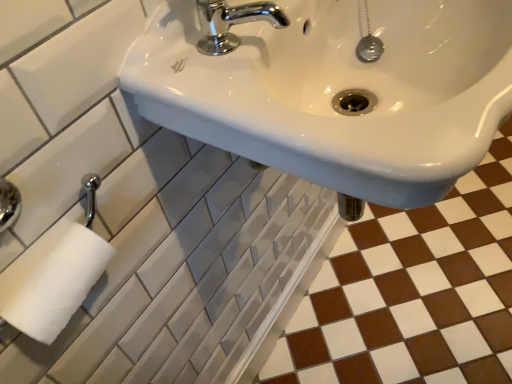
This screenshot has height=384, width=512. What do you see at coordinates (232, 23) in the screenshot?
I see `chrome/metallic faucet at upper center` at bounding box center [232, 23].

Find the location of `brown glossy tile at lower right`. brown glossy tile at lower right is located at coordinates (413, 293).

Is chrome/metallic faucet at upper center oriented towards white glossy sink at upper center?

No, chrome/metallic faucet at upper center does not turn towards white glossy sink at upper center.

Is chrome/metallic faucet at upper center spatially inside white glossy sink at upper center, or outside of it?

chrome/metallic faucet at upper center fits inside white glossy sink at upper center.

Is point (227, 8) positioned in front of point (275, 140)?

No, (227, 8) is behind (275, 140).

Looking at this image, is brown glossy tile at lower right positioned beyond the bounds of chrome/metallic faucet at upper center?

Absolutely, brown glossy tile at lower right is external to chrome/metallic faucet at upper center.

Considering the sizes of brown glossy tile at lower right and chrome/metallic faucet at upper center in the image, is brown glossy tile at lower right bigger or smaller than chrome/metallic faucet at upper center?

Considering their sizes, brown glossy tile at lower right takes up more space than chrome/metallic faucet at upper center.

Identify the location of ceramic tile on the right side of chrome/metallic faucet at upper center. This screenshot has width=512, height=384. (413, 293).

Which point is more forward, (284, 18) or (336, 244)?

Positioned in front is point (284, 18).

Is chrome/metallic faucet at upper center thinner than brown glossy tile at lower right?

Yes.

Is chrome/metallic faucet at upper center turned away from brown glossy tile at lower right?

No, chrome/metallic faucet at upper center is not facing away from brown glossy tile at lower right.

From a real-world perspective, is chrome/metallic faucet at upper center physically above brown glossy tile at lower right?

Yes.

Which is less distant, (308, 368) or (172, 42)?

Point (308, 368) is positioned farther from the camera compared to point (172, 42).

Considering the relative sizes of brown glossy tile at lower right and white glossy sink at upper center in the image provided, is brown glossy tile at lower right shorter than white glossy sink at upper center?

Indeed, brown glossy tile at lower right has a lesser height compared to white glossy sink at upper center.

Choose the correct answer: Is brown glossy tile at lower right inside white glossy sink at upper center or outside it?

brown glossy tile at lower right is outside white glossy sink at upper center.

How different are the orientations of brown glossy tile at lower right and white glossy sink at upper center in degrees?

The angular difference between brown glossy tile at lower right and white glossy sink at upper center is 90.9 degrees.

From the image's perspective, between white glossy sink at upper center and brown glossy tile at lower right, which one is located above?

white glossy sink at upper center, from the image's perspective.

Which is more to the right, white glossy sink at upper center or brown glossy tile at lower right?

brown glossy tile at lower right.

Does point (487, 50) appear closer or farther from the camera than point (295, 365)?

Point (487, 50).

Is white glossy sink at upper center not close to chrome/metallic faucet at upper center?

No, white glossy sink at upper center is not far away from chrome/metallic faucet at upper center.

Is white glossy sink at upper center turned away from chrome/metallic faucet at upper center?

No, white glossy sink at upper center is not facing away from chrome/metallic faucet at upper center.

From the image's perspective, which is above, white glossy sink at upper center or chrome/metallic faucet at upper center?

chrome/metallic faucet at upper center is shown above in the image.

Consider the image. How far apart are white glossy sink at upper center and chrome/metallic faucet at upper center?

The distance of white glossy sink at upper center from chrome/metallic faucet at upper center is 13.66 centimeters.

Where is `tap above the white glossy sink at upper center (from a real-world perspective)`? The width and height of the screenshot is (512, 384). tap above the white glossy sink at upper center (from a real-world perspective) is located at coordinates point(232,23).

Identify the location of tap to the left of brown glossy tile at lower right. This screenshot has width=512, height=384. (232, 23).

Looking at the image, which one is located further to brown glossy tile at lower right, chrome/metallic faucet at upper center or white glossy sink at upper center?

chrome/metallic faucet at upper center is positioned further to the anchor brown glossy tile at lower right.

Considering their positions, is chrome/metallic faucet at upper center positioned closer to white glossy sink at upper center than brown glossy tile at lower right?

Based on the image, chrome/metallic faucet at upper center appears to be nearer to white glossy sink at upper center.

Looking at the image, which one is located further to brown glossy tile at lower right, white glossy sink at upper center or chrome/metallic faucet at upper center?

chrome/metallic faucet at upper center lies further to brown glossy tile at lower right than the other object.

Based on their spatial positions, is brown glossy tile at lower right or chrome/metallic faucet at upper center closer to white glossy sink at upper center?

Based on the image, chrome/metallic faucet at upper center appears to be nearer to white glossy sink at upper center.

Considering their positions, is white glossy sink at upper center positioned closer to chrome/metallic faucet at upper center than brown glossy tile at lower right?

Based on the image, white glossy sink at upper center appears to be nearer to chrome/metallic faucet at upper center.

When comparing their distances from chrome/metallic faucet at upper center, does brown glossy tile at lower right or white glossy sink at upper center seem closer?

Based on the image, white glossy sink at upper center appears to be nearer to chrome/metallic faucet at upper center.

What are the coordinates of `tap positioned between white glossy sink at upper center and brown glossy tile at lower right from near to far` in the screenshot? It's located at (232, 23).